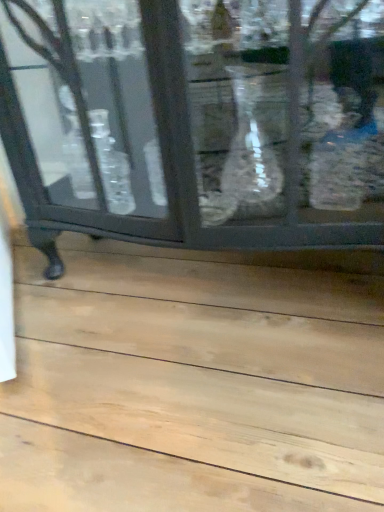
In order to face matte glass cabinet at center, should I rotate leftwards or rightwards?

Rotate left and turn 0.044 degrees.

This screenshot has height=512, width=384. What do you see at coordinates (196, 121) in the screenshot? I see `matte glass cabinet at center` at bounding box center [196, 121].

Where is `matte glass cabinet at center`? matte glass cabinet at center is located at coordinates pos(196,121).

Measure the distance between point (114, 204) and camera.

The distance of point (114, 204) from camera is 3.63 feet.

Find the location of a particular element. matte glass cabinet at center is located at coordinates (196, 121).